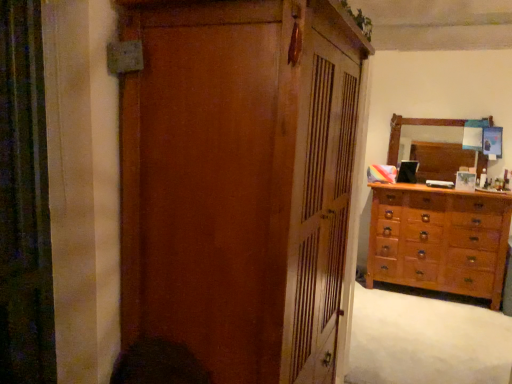
Question: Should I look upward or downward to see wooden dresser at lower right?

Choices:
 (A) down
 (B) up

Answer: (A)

Question: Is light brown wooden dresser at right looking in the opposite direction of matte wood cupboard at center?

Choices:
 (A) yes
 (B) no

Answer: (B)

Question: From the image's perspective, is light brown wooden dresser at right located beneath matte wood cupboard at center?

Choices:
 (A) yes
 (B) no

Answer: (A)

Question: Is light brown wooden dresser at right positioned in front of matte wood cupboard at center?

Choices:
 (A) no
 (B) yes

Answer: (A)

Question: Considering the relative sizes of light brown wooden dresser at right and matte wood cupboard at center in the image provided, is light brown wooden dresser at right bigger than matte wood cupboard at center?

Choices:
 (A) no
 (B) yes

Answer: (A)

Question: Can you confirm if light brown wooden dresser at right is wider than matte wood cupboard at center?

Choices:
 (A) no
 (B) yes

Answer: (A)

Question: Could you tell me if light brown wooden dresser at right is facing matte wood cupboard at center?

Choices:
 (A) no
 (B) yes

Answer: (B)

Question: Considering the relative sizes of wooden dresser at lower right and matte wood cupboard at center in the image provided, is wooden dresser at lower right taller than matte wood cupboard at center?

Choices:
 (A) no
 (B) yes

Answer: (A)

Question: Does wooden dresser at lower right have a lesser width compared to matte wood cupboard at center?

Choices:
 (A) yes
 (B) no

Answer: (B)

Question: Could you tell me if wooden dresser at lower right is facing matte wood cupboard at center?

Choices:
 (A) no
 (B) yes

Answer: (A)

Question: Could matte wood cupboard at center be considered to be inside wooden dresser at lower right?

Choices:
 (A) no
 (B) yes

Answer: (A)

Question: Does wooden dresser at lower right have a larger size compared to matte wood cupboard at center?

Choices:
 (A) no
 (B) yes

Answer: (A)

Question: From the image's perspective, is wooden dresser at lower right above matte wood cupboard at center?

Choices:
 (A) no
 (B) yes

Answer: (A)

Question: Would you say wooden mirror at upper right is part of light brown wooden dresser at right's contents?

Choices:
 (A) no
 (B) yes

Answer: (A)